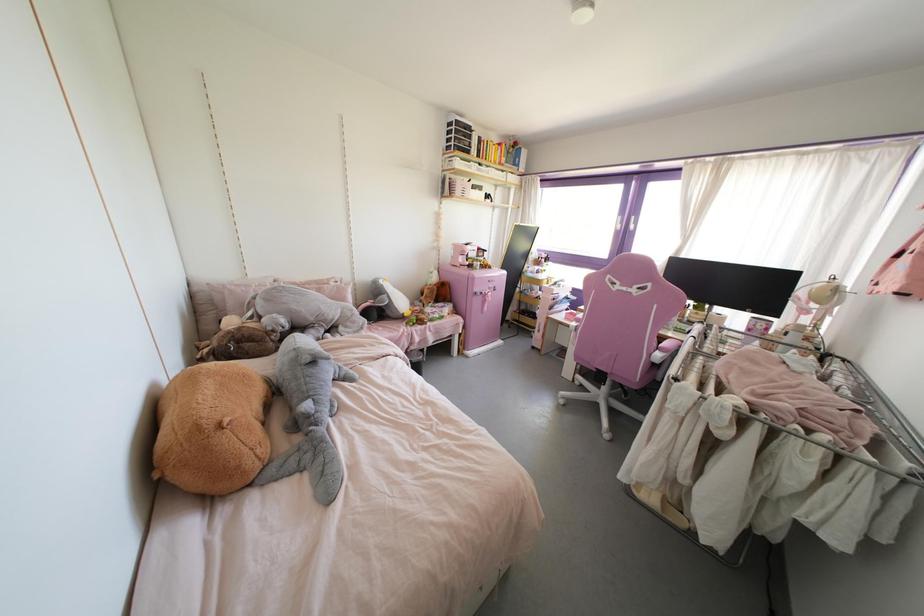
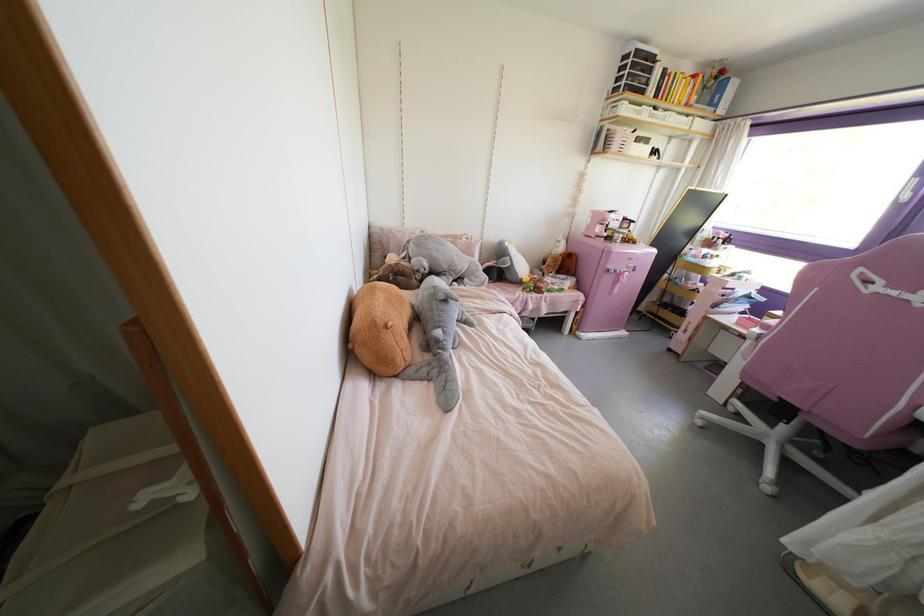
Where in the second image is the point corresponding to point (493, 290) from the first image?

(633, 270)